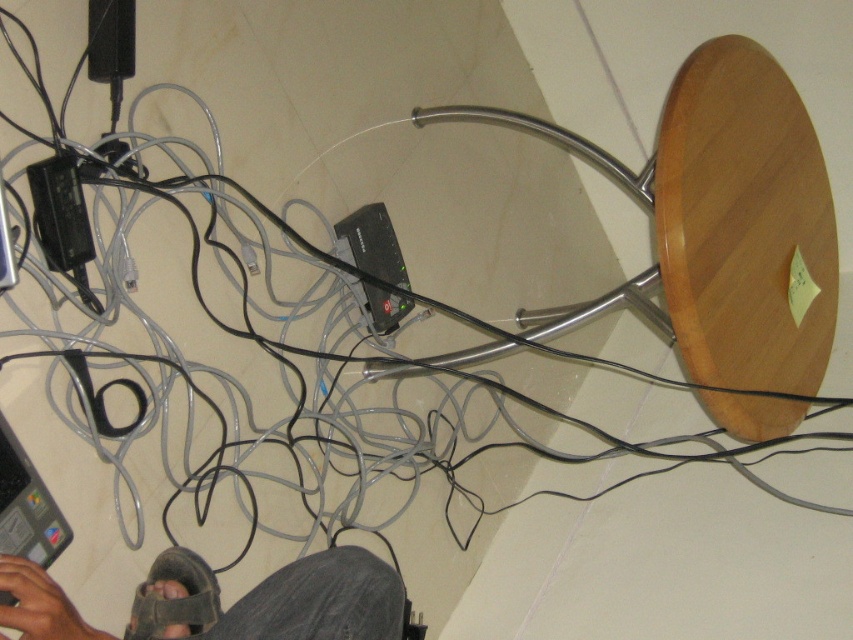
You are trying to navigate through the cluttered corner of the room and need to step over objects on the floor. You see the brown leather sandal at lower left and the black plastic plug at lower left. Which object should you avoid stepping on if you want to step over the shorter one?

You should avoid stepping on the brown leather sandal at lower left because it is shorter than the black plastic plug at lower left, making it easier to step over.

You are trying to navigate through the cluttered corner and need to step over an object. Which object, the brown leather sandal at lower left or the black plastic plug at lower left, is bigger and safer to step over?

The brown leather sandal at lower left has a larger size compared to the black plastic plug at lower left, so it is safer to step over the brown leather sandal at lower left.

You are trying to navigate through the cluttered corner of the room to retrieve an item from the floor. You see a brown leather sandal at lower left and a black plastic plug at lower left. Which object is wider when viewed from above?

The brown leather sandal at lower left is wider than the black plastic plug at lower left.